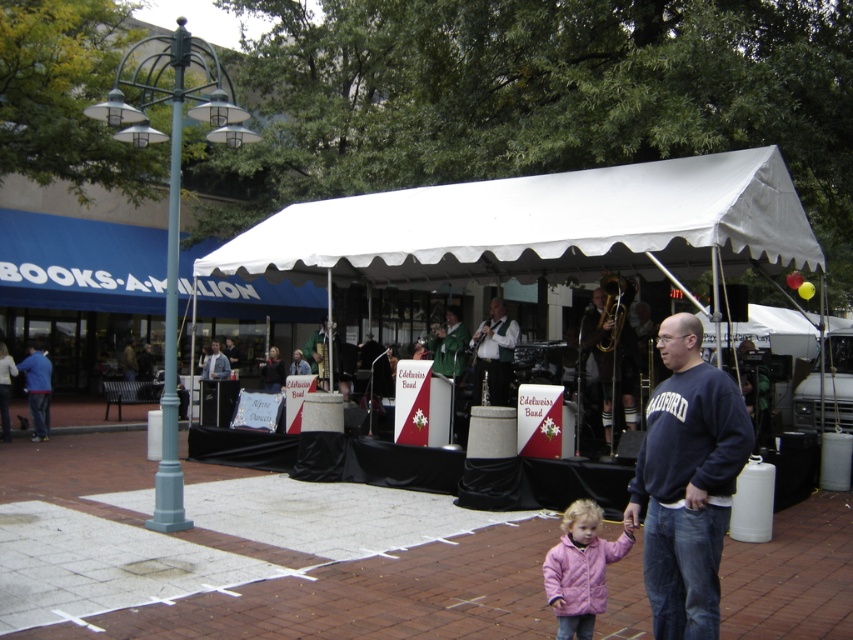
Question: Is navy blue sweatshirt at lower right closer to camera compared to pink quilted jacket at lower center?

Choices:
 (A) yes
 (B) no

Answer: (A)

Question: Is shiny silver trumpet at center to the left of blue denim jeans at left from the viewer's perspective?

Choices:
 (A) yes
 (B) no

Answer: (B)

Question: Considering the real-world distances, which object is farthest from the light blue fabric jacket at center?

Choices:
 (A) blue denim jeans at left
 (B) shiny silver trumpet at center
 (C) white fabric tent at center
 (D) green fabric jacket at center

Answer: (C)

Question: Which of the following is the farthest from the observer?

Choices:
 (A) white fabric canopy at center
 (B) blue denim jeans at left

Answer: (B)

Question: Which object is positioned farthest from the white fabric tent at center?

Choices:
 (A) shiny silver trumpet at center
 (B) light blue fabric jacket at center

Answer: (B)

Question: Is shiny silver trumpet at center bigger than light blue fabric jacket at center?

Choices:
 (A) no
 (B) yes

Answer: (A)